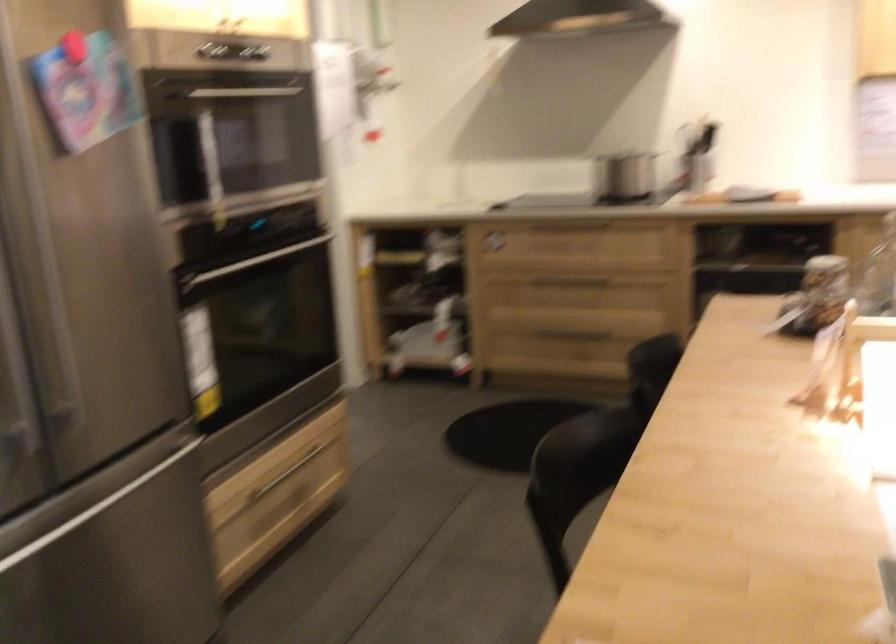
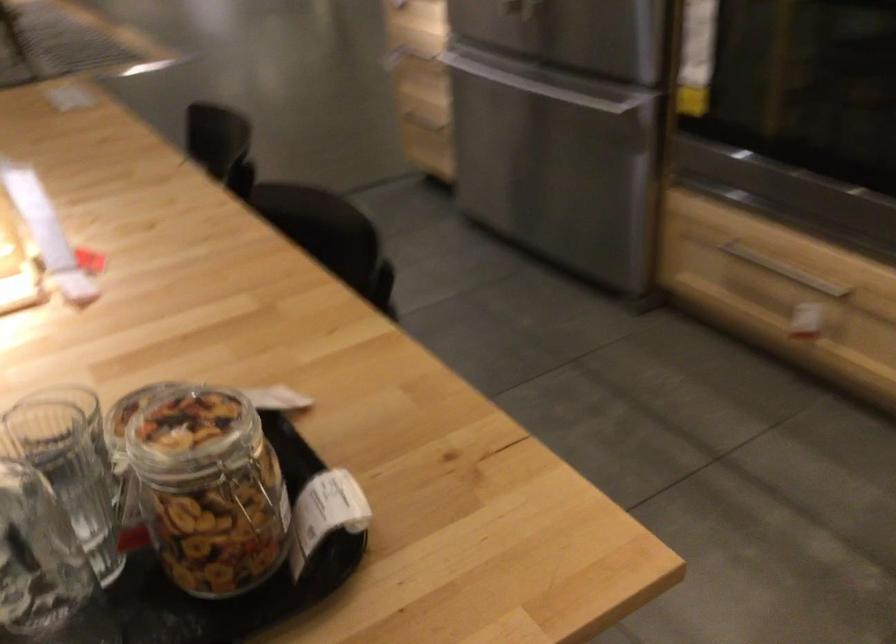
Where in the second image is the point corresponding to (771,314) from the first image?

(293, 453)